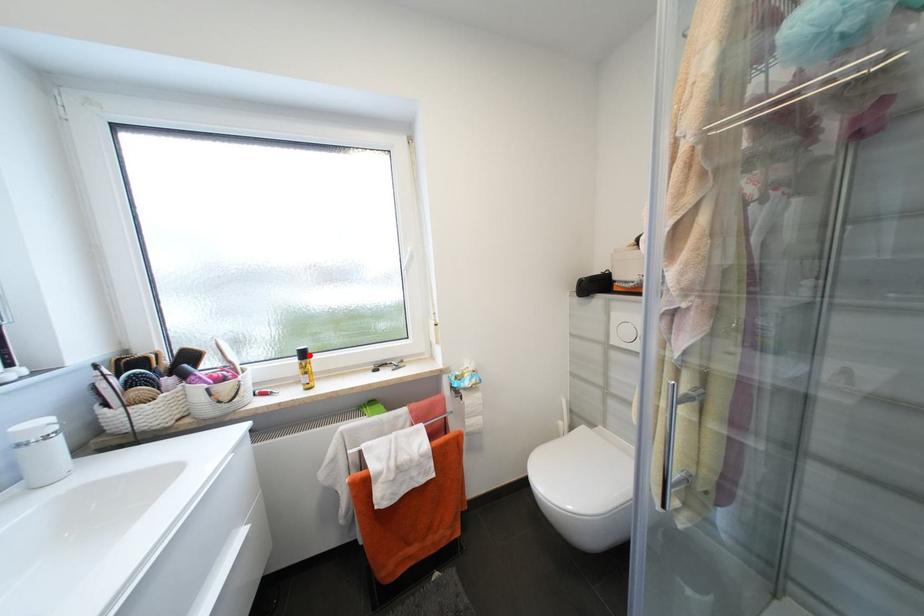
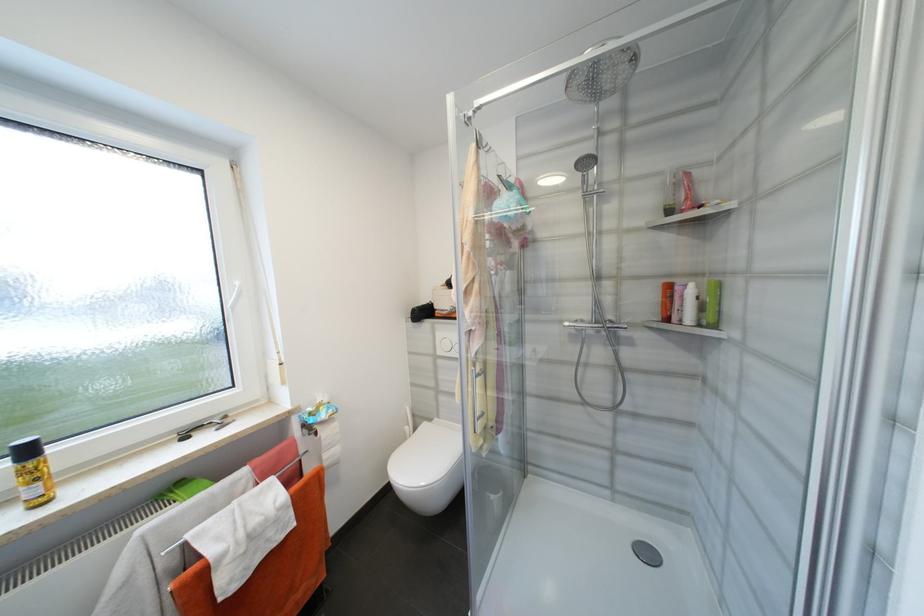
The point at the highlighted location is marked in the first image. Where is the corresponding point in the second image?

(33, 453)